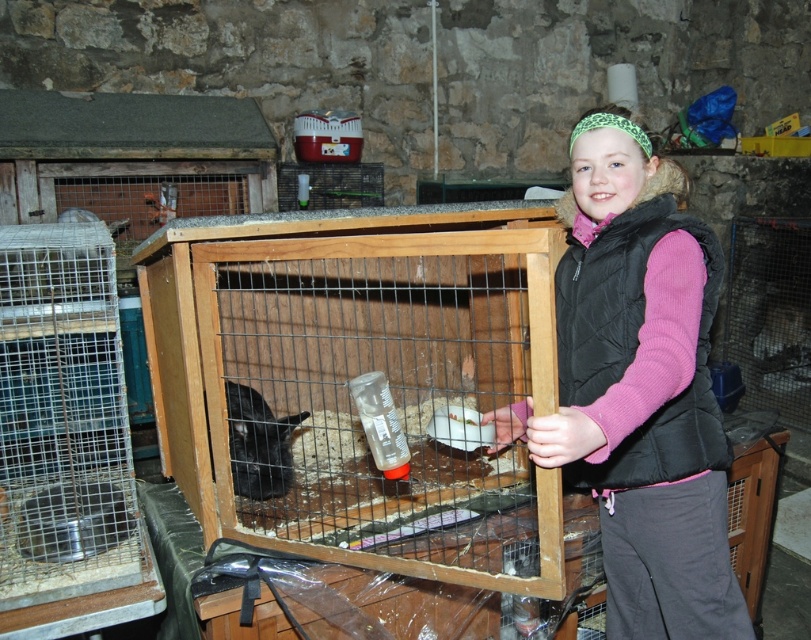
Question: Considering the relative positions of black quilted vest at center and black fur rabbit at center in the image provided, where is black quilted vest at center located with respect to black fur rabbit at center?

Choices:
 (A) above
 (B) below

Answer: (A)

Question: Is black quilted vest at center below black fur rabbit at center?

Choices:
 (A) yes
 (B) no

Answer: (B)

Question: Which object is farther from the camera taking this photo?

Choices:
 (A) black quilted vest at center
 (B) black fur rabbit at center

Answer: (B)

Question: Is black quilted vest at center below black fur rabbit at center?

Choices:
 (A) yes
 (B) no

Answer: (B)

Question: Which point is farther to the camera?

Choices:
 (A) (252, 417)
 (B) (651, 490)

Answer: (A)